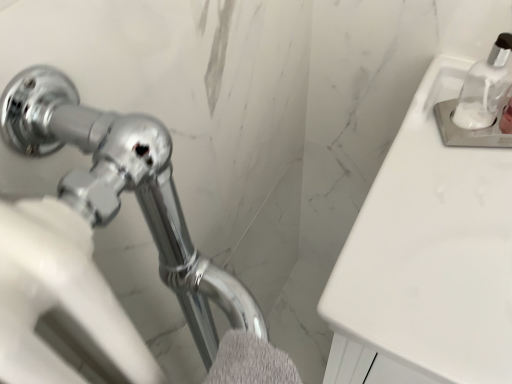
Image resolution: width=512 pixels, height=384 pixels. What are the coordinates of `free area behind clear glass soap dispenser at upper right` in the screenshot? It's located at (447, 94).